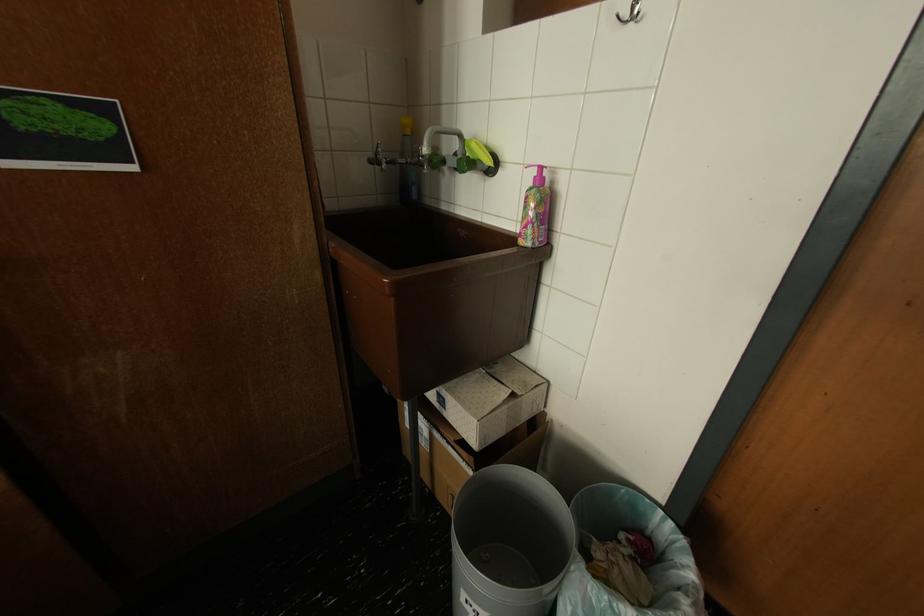
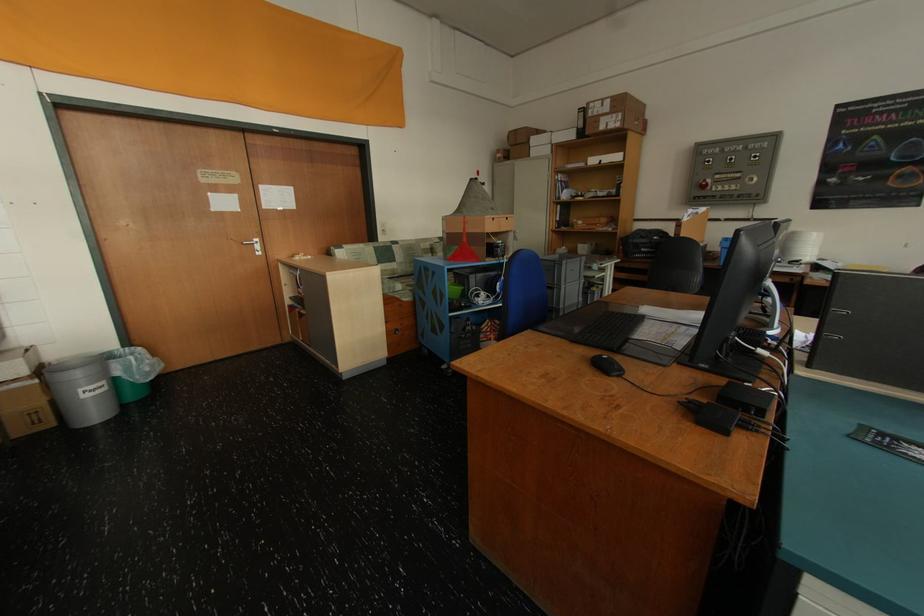
The point at (468, 408) is marked in the first image. Where is the corresponding point in the second image?

(10, 363)